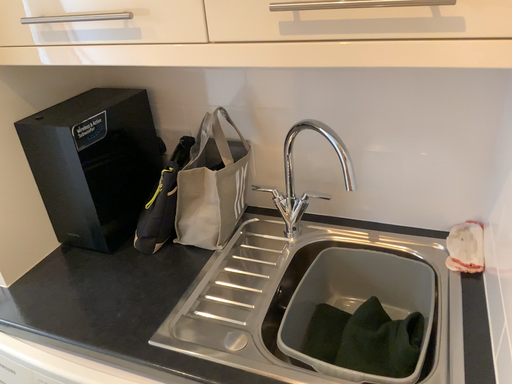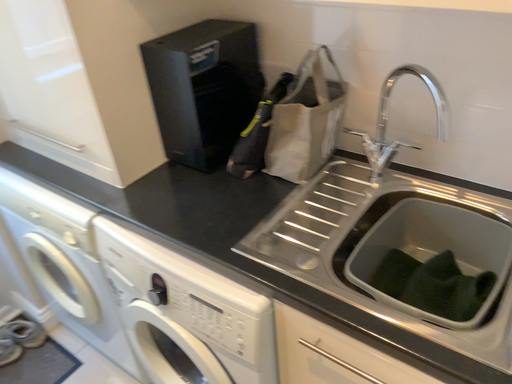
Question: How did the camera likely rotate when shooting the video?

Choices:
 (A) rotated right
 (B) rotated left

Answer: (B)